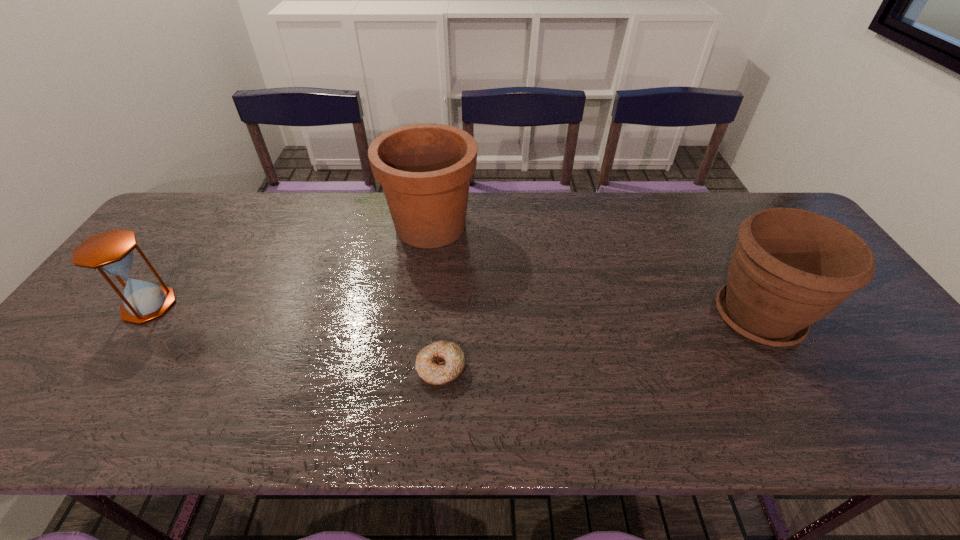
Where is `the left flowerpot`? The width and height of the screenshot is (960, 540). the left flowerpot is located at coordinates (424, 169).

Locate an element on the screen. Image resolution: width=960 pixels, height=540 pixels. the farthest object is located at coordinates (424, 169).

Where is `the rightmost object`? This screenshot has width=960, height=540. the rightmost object is located at coordinates click(x=790, y=268).

Identify the location of the right flowerpot. (790, 268).

Identify the location of hourglass. Image resolution: width=960 pixels, height=540 pixels. (111, 252).

Find the location of `the third tallest object`. the third tallest object is located at coordinates (111, 252).

The image size is (960, 540). Identify the location of doughnut. (441, 362).

Find the location of a particular element. This screenshot has height=540, width=960. vacant area located on the left of the left flowerpot is located at coordinates (256, 226).

This screenshot has width=960, height=540. Find the location of `free space located on the front of the nearer flowerpot`. free space located on the front of the nearer flowerpot is located at coordinates (805, 400).

At what (x,y) coordinates should I click in order to perform the action: click on vacant space located on the left of the second shortest object. Please return your answer as a coordinate pair (x, y). The height and width of the screenshot is (540, 960). Looking at the image, I should click on (94, 306).